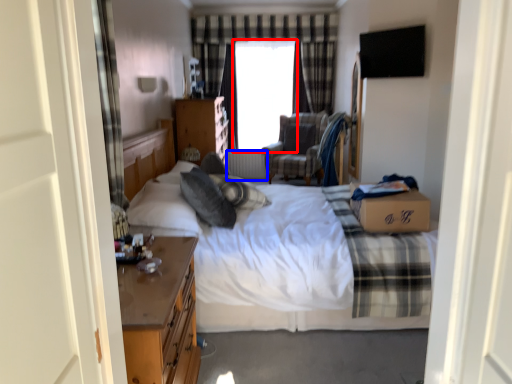
Question: Among these objects, which one is farthest to the camera, window screen (highlighted by a red box) or radiator (highlighted by a blue box)?

Choices:
 (A) window screen
 (B) radiator

Answer: (B)